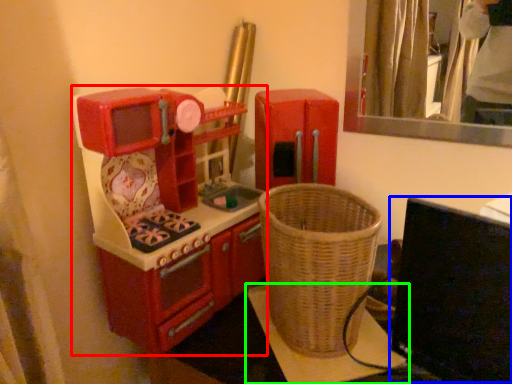
Question: Considering the real-world distances, which object is closest to appliance (highlighted by a red box)? computer monitor (highlighted by a blue box) or furniture (highlighted by a green box).

Choices:
 (A) computer monitor
 (B) furniture

Answer: (B)